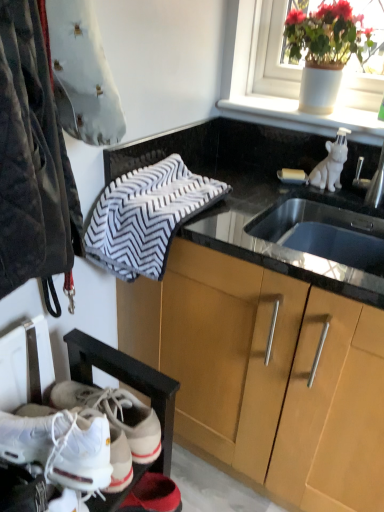
Question: Can you see white ceramic pot at upper right touching white leather sneakers at lower left?

Choices:
 (A) yes
 (B) no

Answer: (B)

Question: Can you confirm if white ceramic pot at upper right is positioned to the right of white leather sneakers at lower left?

Choices:
 (A) no
 (B) yes

Answer: (B)

Question: Is white ceramic pot at upper right far away from white leather sneakers at lower left?

Choices:
 (A) no
 (B) yes

Answer: (B)

Question: Is white leather sneakers at lower left at the back of white ceramic pot at upper right?

Choices:
 (A) yes
 (B) no

Answer: (B)

Question: Is white leather sneakers at lower left surrounded by white ceramic pot at upper right?

Choices:
 (A) yes
 (B) no

Answer: (B)

Question: Is white ceramic pot at upper right bigger than white leather sneakers at lower left?

Choices:
 (A) yes
 (B) no

Answer: (A)

Question: Does velvet-like gray pillow at upper left, arranged as the 2th animal when viewed from the back, come behind white glossy ceramic dog at upper right, the 2th animal from the front?

Choices:
 (A) yes
 (B) no

Answer: (B)

Question: Considering the relative positions of velvet-like gray pillow at upper left, arranged as the 2th animal when viewed from the back, and white glossy ceramic dog at upper right, which is counted as the 2th animal, starting from the left, in the image provided, is velvet-like gray pillow at upper left, arranged as the 2th animal when viewed from the back, in front of white glossy ceramic dog at upper right, which is counted as the 2th animal, starting from the left,?

Choices:
 (A) no
 (B) yes

Answer: (B)

Question: Does velvet-like gray pillow at upper left, the 1th animal viewed from the left, have a greater height compared to white glossy ceramic dog at upper right, which is counted as the 2th animal, starting from the left?

Choices:
 (A) no
 (B) yes

Answer: (B)

Question: Does velvet-like gray pillow at upper left, the 1th animal viewed from the left, have a lesser width compared to white glossy ceramic dog at upper right, the 1th animal viewed from the right?

Choices:
 (A) yes
 (B) no

Answer: (B)

Question: From the image's perspective, does velvet-like gray pillow at upper left, the first animal in the front-to-back sequence, appear lower than white glossy ceramic dog at upper right, which is counted as the 2th animal, starting from the left?

Choices:
 (A) no
 (B) yes

Answer: (A)

Question: Is white leather sneakers at lower left positioned with its back to white ceramic pot at upper right?

Choices:
 (A) yes
 (B) no

Answer: (B)